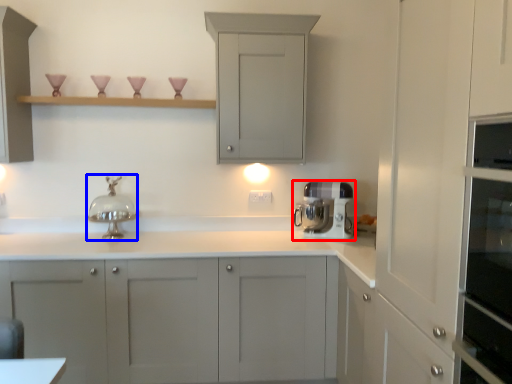
Question: Among these objects, which one is farthest to the camera, home appliance (highlighted by a red box) or faucet (highlighted by a blue box)?

Choices:
 (A) home appliance
 (B) faucet

Answer: (A)